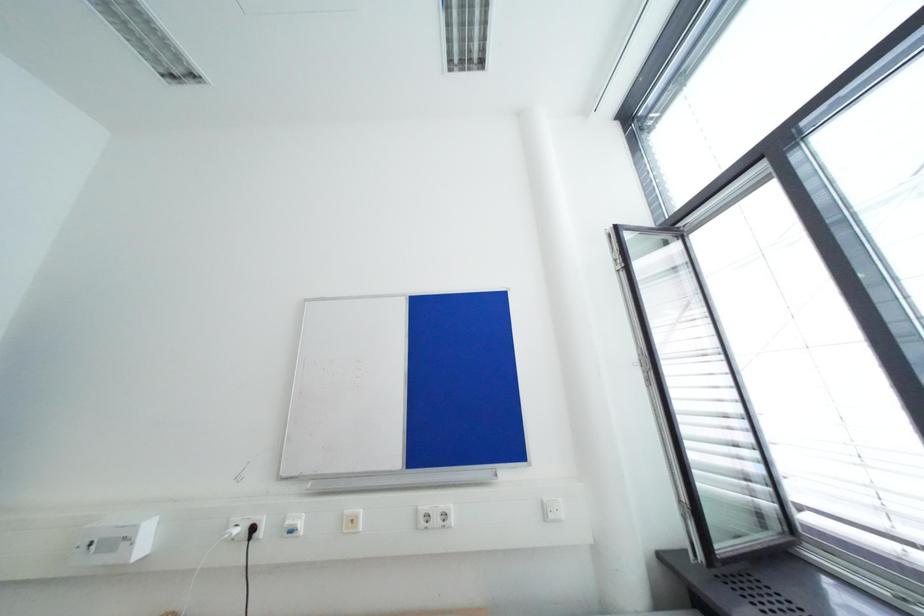
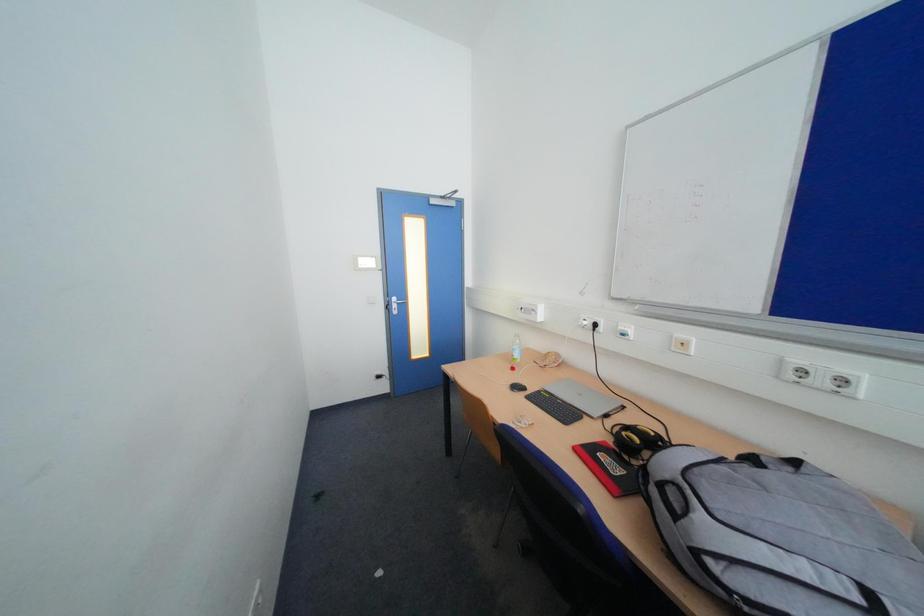
The images are taken continuously from a first-person perspective. In which direction is your viewpoint rotating?

The camera rotated toward left-down.